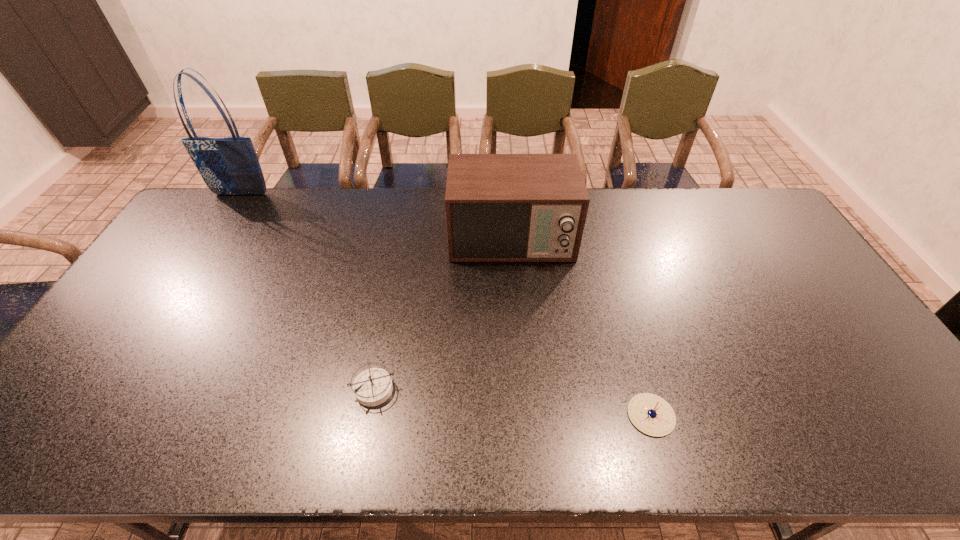
Locate an element on the screen. This screenshot has height=540, width=960. the second closest object relative to the rightmost object is located at coordinates (372, 387).

Locate an element on the screen. vacant space that satisfies the following two spatial constraints: 1. on the front-facing side of the second object from left to right; 2. on the left side of the farthest object is located at coordinates (117, 388).

Identify the location of vacant position in the image that satisfies the following two spatial constraints: 1. on the front-facing side of the third object from left to right; 2. on the left side of the rightmost object. Image resolution: width=960 pixels, height=540 pixels. (524, 415).

In order to click on free space that satisfies the following two spatial constraints: 1. on the front-facing side of the rightmost object; 2. on the left side of the third object from left to right in this screenshot , I will do pos(524,415).

Identify the location of free space that satisfies the following two spatial constraints: 1. on the front-facing side of the third object from right to left; 2. on the right side of the farthest object. The width and height of the screenshot is (960, 540). (117, 388).

Where is `free point that satisfies the following two spatial constraints: 1. on the front-facing side of the leftmost object; 2. on the right side of the left compass`? The height and width of the screenshot is (540, 960). free point that satisfies the following two spatial constraints: 1. on the front-facing side of the leftmost object; 2. on the right side of the left compass is located at coordinates (117, 388).

Locate an element on the screen. The height and width of the screenshot is (540, 960). vacant area that satisfies the following two spatial constraints: 1. on the front-facing side of the second object from left to right; 2. on the left side of the leftmost object is located at coordinates (117, 388).